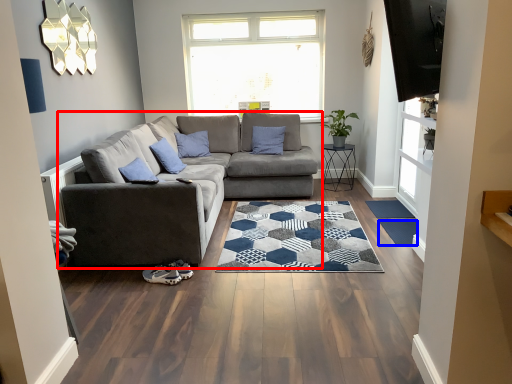
Question: Among these objects, which one is farthest to the camera, studio couch (highlighted by a red box) or mat (highlighted by a blue box)?

Choices:
 (A) studio couch
 (B) mat

Answer: (B)